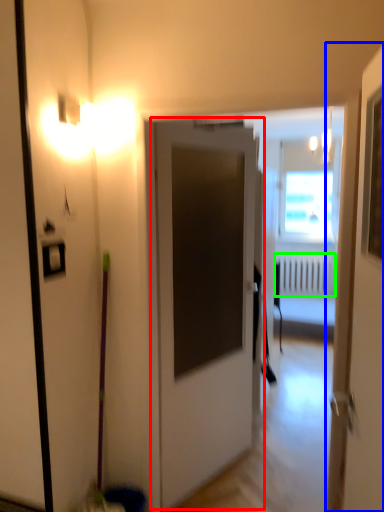
Question: Which is nearer to the door (highlighted by a red box)? door (highlighted by a blue box) or radiator (highlighted by a green box).

Choices:
 (A) door
 (B) radiator

Answer: (A)